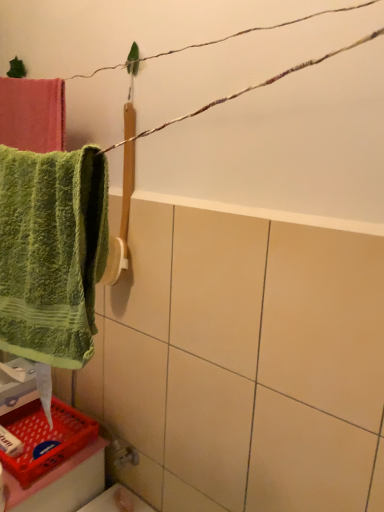
Question: Is white matte soap at lower left smaller than green textured towel at left?

Choices:
 (A) no
 (B) yes

Answer: (B)

Question: From the image's perspective, is white matte soap at lower left over green textured towel at left?

Choices:
 (A) no
 (B) yes

Answer: (A)

Question: Is green textured towel at left completely or partially inside white matte soap at lower left?

Choices:
 (A) yes
 (B) no

Answer: (B)

Question: From a real-world perspective, is white matte soap at lower left below green textured towel at left?

Choices:
 (A) yes
 (B) no

Answer: (A)

Question: Considering the relative sizes of white matte soap at lower left and green textured towel at left in the image provided, is white matte soap at lower left bigger than green textured towel at left?

Choices:
 (A) no
 (B) yes

Answer: (A)

Question: Looking at their shapes, would you say red plastic basket at lower left is wider or thinner than green textured towel at left?

Choices:
 (A) wide
 (B) thin

Answer: (A)

Question: Is red plastic basket at lower left in front of or behind green textured towel at left in the image?

Choices:
 (A) front
 (B) behind

Answer: (B)

Question: Is red plastic basket at lower left taller or shorter than green textured towel at left?

Choices:
 (A) short
 (B) tall

Answer: (A)

Question: From a real-world perspective, is red plastic basket at lower left positioned above or below green textured towel at left?

Choices:
 (A) above
 (B) below

Answer: (B)

Question: Considering the positions of white matte soap at lower left and green textured towel at left in the image, is white matte soap at lower left wider or thinner than green textured towel at left?

Choices:
 (A) thin
 (B) wide

Answer: (A)

Question: Is white matte soap at lower left taller or shorter than green textured towel at left?

Choices:
 (A) short
 (B) tall

Answer: (A)

Question: From a real-world perspective, is white matte soap at lower left positioned above or below green textured towel at left?

Choices:
 (A) above
 (B) below

Answer: (B)

Question: Which is correct: white matte soap at lower left is inside green textured towel at left, or outside of it?

Choices:
 (A) outside
 (B) inside

Answer: (A)

Question: From a real-world perspective, is red plastic basket at lower left above or below white matte soap at lower left?

Choices:
 (A) below
 (B) above

Answer: (A)

Question: In the image, is red plastic basket at lower left on the left side or the right side of white matte soap at lower left?

Choices:
 (A) right
 (B) left

Answer: (A)